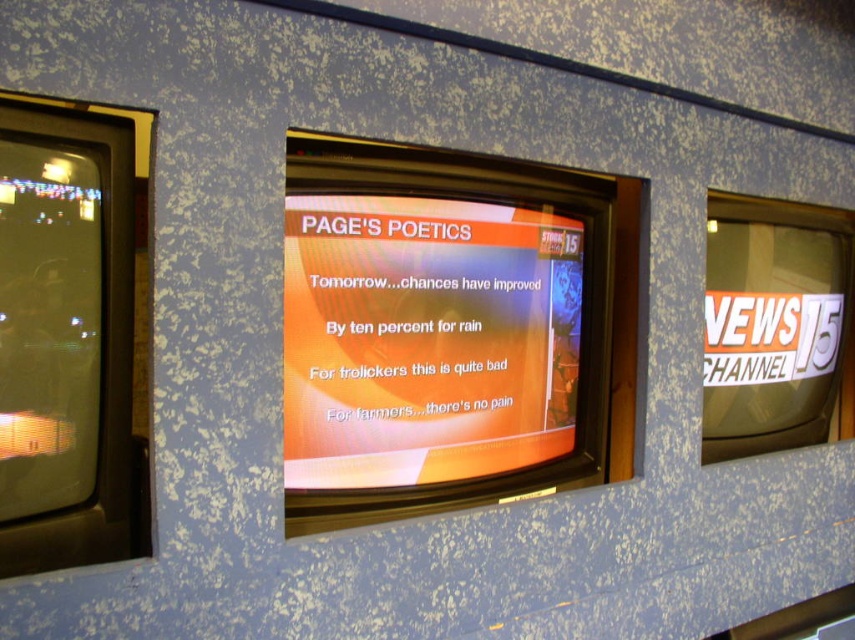
Is orange glossy text at center closer to camera compared to matte black screen at left?

No, it is behind matte black screen at left.

Which is more to the right, orange glossy text at center or matte black screen at left?

From the viewer's perspective, orange glossy text at center appears more on the right side.

Find the location of a particular element. Image resolution: width=855 pixels, height=640 pixels. orange glossy text at center is located at coordinates (425, 339).